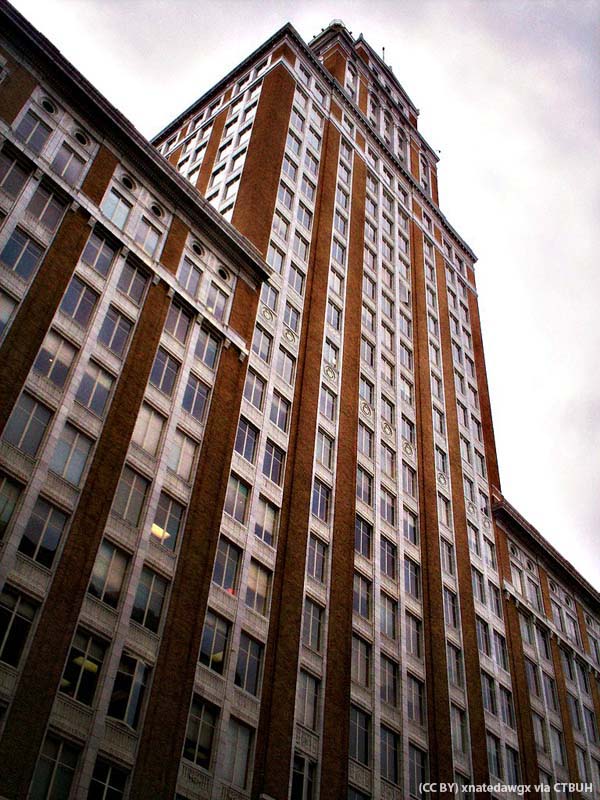
The image size is (600, 800). I want to click on celling lights turned on inside the building, so (x=210, y=309), (x=217, y=654), (x=89, y=662), (x=161, y=530).